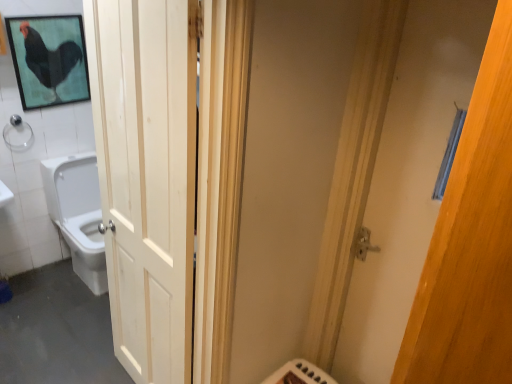
This screenshot has width=512, height=384. Describe the element at coordinates (471, 243) in the screenshot. I see `wooden door at right, which ranks as the 2th door in left-to-right order` at that location.

You are a GUI agent. You are given a task and a screenshot of the screen. Output one action in this format:
    pyautogui.click(x=<x>, y=<y>)
    Task: Click on the white wood door at left, placed as the second door when sorted from right to left
    
    Given the screenshot: What is the action you would take?
    pyautogui.click(x=147, y=176)

Locate an element on the screen. white glossy toilet at left is located at coordinates (78, 214).

What is the approximate height of black matte chicken at upper left?

black matte chicken at upper left is 55.23 centimeters tall.

Locate an element on the screen. Image resolution: width=512 pixels, height=384 pixels. clear glass shower at upper left is located at coordinates (17, 129).

From the picture: Which is farther, (462, 332) or (12, 127)?

The point (12, 127) is more distant.

Is wooden door at right, arranged as the first door when viewed from the right, far from clear glass shower at upper left?

That's right, there is a large distance between wooden door at right, arranged as the first door when viewed from the right, and clear glass shower at upper left.

At what (x,y) coordinates should I click in order to perform the action: click on shower behind the wooden door at right, arranged as the first door when viewed from the right. Please return your answer as a coordinate pair (x, y). This screenshot has height=384, width=512. Looking at the image, I should click on point(17,129).

From a real-world perspective, is wooden door at right, arranged as the first door when viewed from the right, physically above clear glass shower at upper left?

Yes, from a real-world perspective, wooden door at right, arranged as the first door when viewed from the right, is on top of clear glass shower at upper left.

From the picture: Does black matte chicken at upper left have a greater height compared to white glossy toilet at left?

No, black matte chicken at upper left is not taller than white glossy toilet at left.

From a real-world perspective, does black matte chicken at upper left stand above white glossy toilet at left?

Yes, from a real-world perspective, black matte chicken at upper left is over white glossy toilet at left

Could you tell me if black matte chicken at upper left is facing white glossy toilet at left?

No, black matte chicken at upper left is not aimed at white glossy toilet at left.

Choose the correct answer: Is black matte chicken at upper left inside white glossy toilet at left or outside it?

black matte chicken at upper left is not inside white glossy toilet at left, it's outside.

Is white wood door at left, placed as the second door when sorted from right to left, aimed at black matte chicken at upper left?

No, white wood door at left, placed as the second door when sorted from right to left, is not facing towards black matte chicken at upper left.

Can black matte chicken at upper left be found inside white wood door at left, the 1th door viewed from the left?

That's incorrect, black matte chicken at upper left is not inside white wood door at left, the 1th door viewed from the left.

Is white wood door at left, the 1th door viewed from the left, at the right side of black matte chicken at upper left?

Yes, white wood door at left, the 1th door viewed from the left, is to the right of black matte chicken at upper left.

What's the angular difference between white wood door at left, placed as the second door when sorted from right to left, and black matte chicken at upper left's facing directions?

The angular difference between white wood door at left, placed as the second door when sorted from right to left, and black matte chicken at upper left is 97.3 degrees.

From the image's perspective, which one is positioned lower, clear glass shower at upper left or white wood door at left, the 1th door viewed from the left?

From the image's view, white wood door at left, the 1th door viewed from the left, is below.

Which object is positioned more to the left, clear glass shower at upper left or white wood door at left, the 1th door viewed from the left?

clear glass shower at upper left.

Is clear glass shower at upper left facing towards white wood door at left, placed as the second door when sorted from right to left?

Yes.

Considering the sizes of black matte chicken at upper left and clear glass shower at upper left in the image, is black matte chicken at upper left bigger or smaller than clear glass shower at upper left?

black matte chicken at upper left is bigger than clear glass shower at upper left.

Between black matte chicken at upper left and clear glass shower at upper left, which one has more height?

black matte chicken at upper left.

From the image's perspective, is black matte chicken at upper left positioned above or below clear glass shower at upper left?

black matte chicken at upper left is above clear glass shower at upper left.

From a real-world perspective, which is physically above, wooden door at right, which ranks as the 2th door in left-to-right order, or white glossy toilet at left?

From a 3D spatial view, wooden door at right, which ranks as the 2th door in left-to-right order, is above.

How far apart are wooden door at right, which ranks as the 2th door in left-to-right order, and white glossy toilet at left?

wooden door at right, which ranks as the 2th door in left-to-right order, is 2.41 meters away from white glossy toilet at left.

Between wooden door at right, arranged as the first door when viewed from the right, and white glossy toilet at left, which one is positioned behind?

white glossy toilet at left is more distant.

Which object is thinner, clear glass shower at upper left or white glossy toilet at left?

clear glass shower at upper left is thinner.

How much distance is there between clear glass shower at upper left and white glossy toilet at left?

20.24 inches.

Do you think clear glass shower at upper left is within white glossy toilet at left, or outside of it?

clear glass shower at upper left is located beyond the bounds of white glossy toilet at left.

Is clear glass shower at upper left positioned in front of white glossy toilet at left?

No, clear glass shower at upper left is further to the viewer.

Find the location of `the 2nd door to the right of the clear glass shower at upper left, counting from the anchor's position`. the 2nd door to the right of the clear glass shower at upper left, counting from the anchor's position is located at coordinates (471, 243).

Locate an element on the screen. This screenshot has width=512, height=384. toilet in front of the black matte chicken at upper left is located at coordinates (78, 214).

From the image, which object appears to be nearer to clear glass shower at upper left, black matte chicken at upper left or wooden door at right, arranged as the first door when viewed from the right?

The object closer to clear glass shower at upper left is black matte chicken at upper left.

When comparing their distances from black matte chicken at upper left, does white glossy toilet at left or wooden door at right, arranged as the first door when viewed from the right, seem closer?

Among the two, white glossy toilet at left is located nearer to black matte chicken at upper left.

When comparing their distances from wooden door at right, arranged as the first door when viewed from the right, does white glossy toilet at left or white wood door at left, placed as the second door when sorted from right to left, seem closer?

white wood door at left, placed as the second door when sorted from right to left, is positioned closer to the anchor wooden door at right, arranged as the first door when viewed from the right.

Estimate the real-world distances between objects in this image. Which object is closer to clear glass shower at upper left, white glossy toilet at left or black matte chicken at upper left?

black matte chicken at upper left.

Estimate the real-world distances between objects in this image. Which object is further from clear glass shower at upper left, wooden door at right, arranged as the first door when viewed from the right, or white glossy toilet at left?

wooden door at right, arranged as the first door when viewed from the right, lies further to clear glass shower at upper left than the other object.

Based on their spatial positions, is white wood door at left, the 1th door viewed from the left, or white glossy toilet at left further from black matte chicken at upper left?

white wood door at left, the 1th door viewed from the left.

Looking at the image, which one is located further to clear glass shower at upper left, black matte chicken at upper left or white glossy toilet at left?

white glossy toilet at left lies further to clear glass shower at upper left than the other object.

Estimate the real-world distances between objects in this image. Which object is closer to clear glass shower at upper left, white wood door at left, placed as the second door when sorted from right to left, or white glossy toilet at left?

white glossy toilet at left lies closer to clear glass shower at upper left than the other object.

Find the location of a particular element. This screenshot has width=512, height=384. door between white glossy toilet at left and wooden door at right, which ranks as the 2th door in left-to-right order, from left to right is located at coordinates (147, 176).

At what (x,y) coordinates should I click in order to perform the action: click on chicken between clear glass shower at upper left and wooden door at right, which ranks as the 2th door in left-to-right order. Please return your answer as a coordinate pair (x, y). This screenshot has width=512, height=384. Looking at the image, I should click on (49, 58).

Locate an element on the screen. chicken positioned between white wood door at left, placed as the second door when sorted from right to left, and clear glass shower at upper left from near to far is located at coordinates (49, 58).

This screenshot has height=384, width=512. I want to click on toilet between white wood door at left, placed as the second door when sorted from right to left, and clear glass shower at upper left, along the z-axis, so click(x=78, y=214).